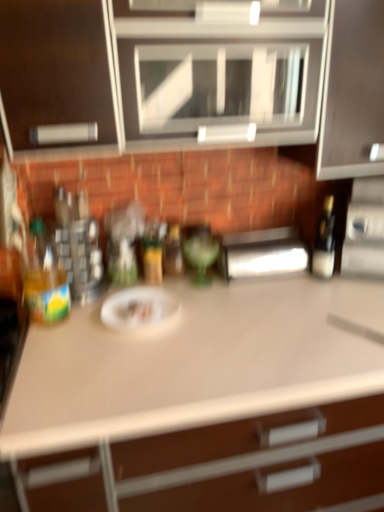
Question: Considering the relative sizes of matte black bottle at right, positioned as the fourth bottle in left-to-right order, and satin silver paper towel dispenser at center, the 2th appliance positioned from the right, in the image provided, is matte black bottle at right, positioned as the fourth bottle in left-to-right order, taller than satin silver paper towel dispenser at center, the 2th appliance positioned from the right,?

Choices:
 (A) yes
 (B) no

Answer: (A)

Question: From the image's perspective, is matte black bottle at right, acting as the 1th bottle starting from the right, under satin silver paper towel dispenser at center, arranged as the 1th appliance when viewed from the left?

Choices:
 (A) no
 (B) yes

Answer: (A)

Question: Does matte black bottle at right, positioned as the fourth bottle in left-to-right order, have a lesser height compared to satin silver paper towel dispenser at center, the 2th appliance positioned from the right?

Choices:
 (A) yes
 (B) no

Answer: (B)

Question: Is matte black bottle at right, positioned as the fourth bottle in left-to-right order, smaller than satin silver paper towel dispenser at center, arranged as the 1th appliance when viewed from the left?

Choices:
 (A) no
 (B) yes

Answer: (B)

Question: Is matte black bottle at right, positioned as the fourth bottle in left-to-right order, facing away from satin silver paper towel dispenser at center, arranged as the 1th appliance when viewed from the left?

Choices:
 (A) no
 (B) yes

Answer: (A)

Question: Considering the positions of white matte paper plate at center and matte black bottle at right, positioned as the fourth bottle in left-to-right order, in the image, is white matte paper plate at center taller or shorter than matte black bottle at right, positioned as the fourth bottle in left-to-right order,?

Choices:
 (A) tall
 (B) short

Answer: (B)

Question: Visually, is white matte paper plate at center positioned to the left or to the right of matte black bottle at right, positioned as the fourth bottle in left-to-right order?

Choices:
 (A) right
 (B) left

Answer: (B)

Question: Considering the positions of white matte paper plate at center and matte black bottle at right, acting as the 1th bottle starting from the right, in the image, is white matte paper plate at center bigger or smaller than matte black bottle at right, acting as the 1th bottle starting from the right,?

Choices:
 (A) small
 (B) big

Answer: (B)

Question: Considering the positions of point [140, 303] and point [314, 268], is point [140, 303] closer or farther from the camera than point [314, 268]?

Choices:
 (A) farther
 (B) closer

Answer: (B)

Question: Which is correct: white matte countertop at center is inside green glass bottle at center, the 2th bottle positioned from the right, or outside of it?

Choices:
 (A) outside
 (B) inside

Answer: (A)

Question: In the image, is white matte countertop at center on the left side or the right side of green glass bottle at center, the 2th bottle positioned from the right?

Choices:
 (A) left
 (B) right

Answer: (B)

Question: Considering their positions, is white matte countertop at center located in front of or behind green glass bottle at center, the 2th bottle positioned from the right?

Choices:
 (A) behind
 (B) front

Answer: (B)

Question: From a real-world perspective, is white matte countertop at center physically located above or below green glass bottle at center, the 2th bottle positioned from the right?

Choices:
 (A) below
 (B) above

Answer: (A)

Question: Would you say satin silver toaster at right, marked as the 1th appliance in a right-to-left arrangement, is inside or outside matte white cabinet at upper center?

Choices:
 (A) outside
 (B) inside

Answer: (A)

Question: In terms of width, does satin silver toaster at right, marked as the 1th appliance in a right-to-left arrangement, look wider or thinner when compared to matte white cabinet at upper center?

Choices:
 (A) wide
 (B) thin

Answer: (B)